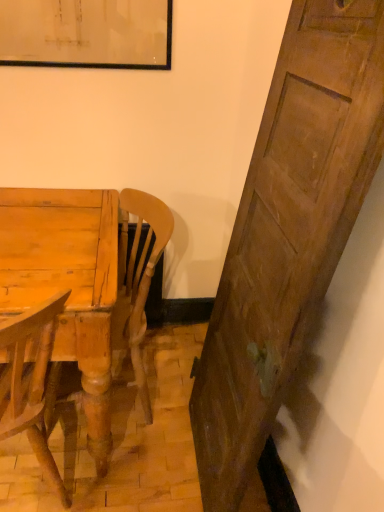
Question: Should I look upward or downward to see light brown wood desk at lower left?

Choices:
 (A) down
 (B) up

Answer: (A)